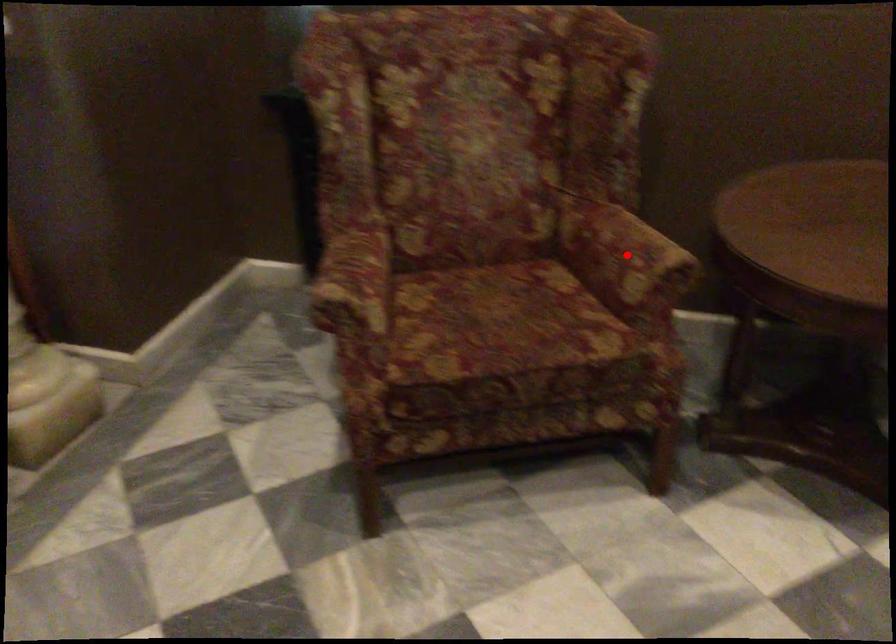
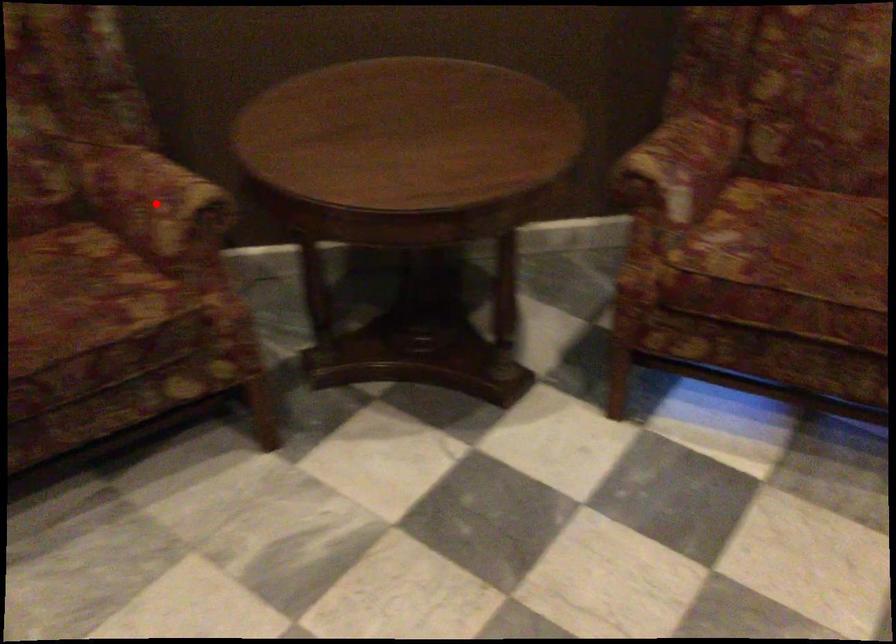
I am providing you with two images of the same scene from different viewpoints. A red point is marked on the first image and another point is marked on the second image. Do the highlighted points in image1 and image2 indicate the same real-world spot?

Yes